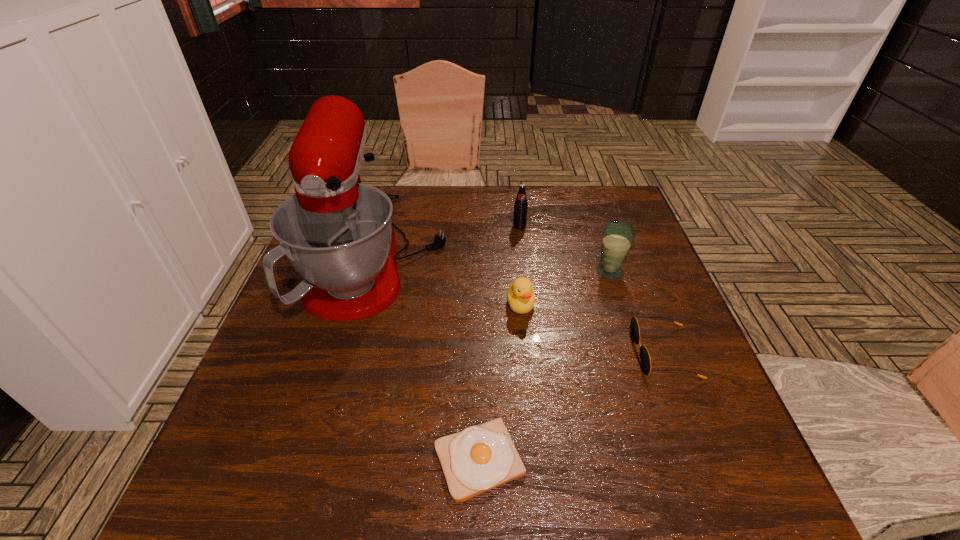
Point out which object is positioned as the fourth nearest to the glass. Please provide its 2D coordinates. Your answer should be formatted as a tuple, i.e. [(x, y)], where the tuple contains the x and y coordinates of a point satisfying the conditions above.

[(337, 233)]

Locate an element on the screen. This screenshot has width=960, height=540. free space in the image that satisfies the following two spatial constraints: 1. on the bowl side of the mixer; 2. on the back side of the toast is located at coordinates (327, 460).

Locate an element on the screen. This screenshot has height=540, width=960. vacant point that satisfies the following two spatial constraints: 1. on the front label of the glass; 2. on the left side of the pop is located at coordinates (524, 271).

Locate an element on the screen. free spot that satisfies the following two spatial constraints: 1. on the front label of the glass; 2. on the left side of the pop is located at coordinates (524, 271).